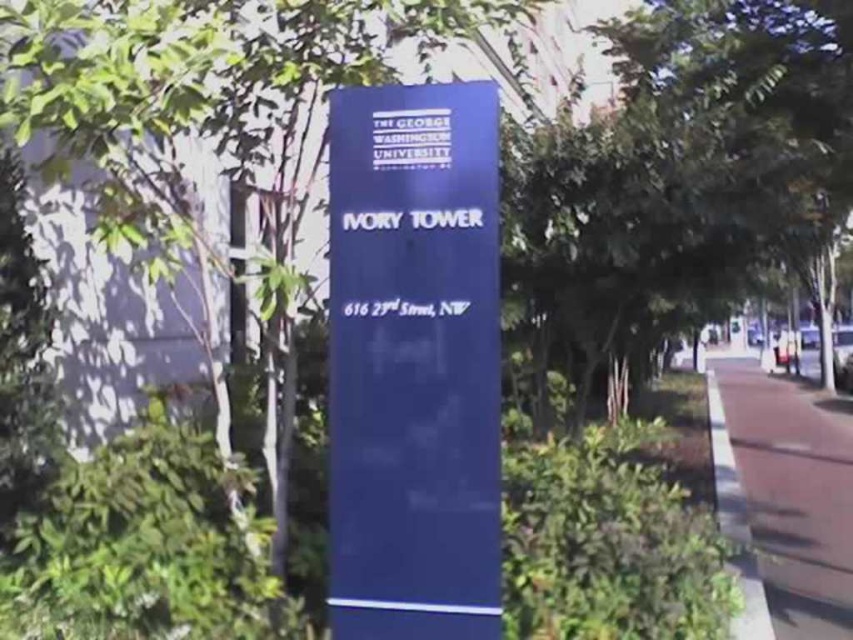
Is point (723, 378) less distant than point (474, 220)?

That is False.

Is brown concrete pavement at lower right bigger than white plastic sign at center?

Correct, brown concrete pavement at lower right is larger in size than white plastic sign at center.

Which is in front, point (778, 445) or point (384, 212)?

Positioned in front is point (384, 212).

This screenshot has width=853, height=640. Find the location of `brown concrete pavement at lower right`. brown concrete pavement at lower right is located at coordinates (782, 500).

Is blue glossy sign at center wider than white paper at center?

Correct, the width of blue glossy sign at center exceeds that of white paper at center.

Does point (494, 144) come farther from viewer compared to point (442, 308)?

Yes, it is.

Identify the location of blue glossy sign at center. Image resolution: width=853 pixels, height=640 pixels. (415, 380).

Can you confirm if white plastic sign at center is wider than white paper at center?

Correct, the width of white plastic sign at center exceeds that of white paper at center.

Consider the image. Which is above, white plastic sign at center or white paper at center?

white plastic sign at center is higher up.

Does point (448, 216) come in front of point (445, 300)?

No, it is not.

Image resolution: width=853 pixels, height=640 pixels. I want to click on white plastic sign at center, so click(413, 218).